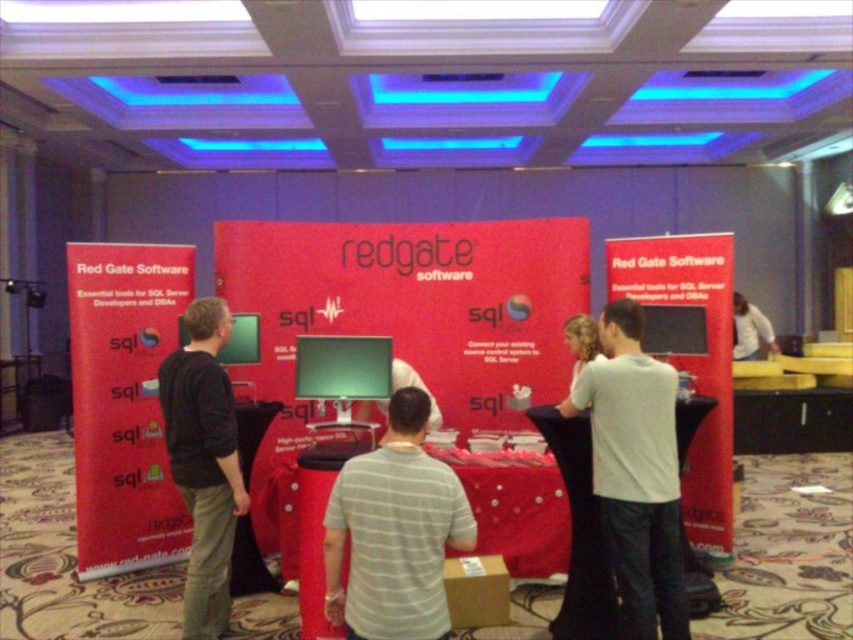
You are at the Red Gate Software booth and notice two shirts on display. Which shirt is positioned to the left when looking at the gray striped shirt at center and the white cotton shirt at center?

The gray striped shirt at center is to the left of the white cotton shirt at center.

You are a photographer at the conference. You need to take a photo of the gray striped shirt at center and the black cotton shirt at left so that both shirts are visible in the frame. Which shirt should you position closer to the camera to ensure both are fully visible?

The gray striped shirt at center has a lesser height compared to the black cotton shirt at left. To ensure both shirts are fully visible in the photo, position the gray striped shirt at center closer to the camera since it is shorter. This way, the shorter shirt won

You are an attendee at the Red Gate Software booth. You notice two shirts at the center of the booth. Which shirt is closer to you, the gray striped shirt at center or the white cotton shirt at center?

The gray striped shirt at center is closer to you because it is in front of the white cotton shirt at center.